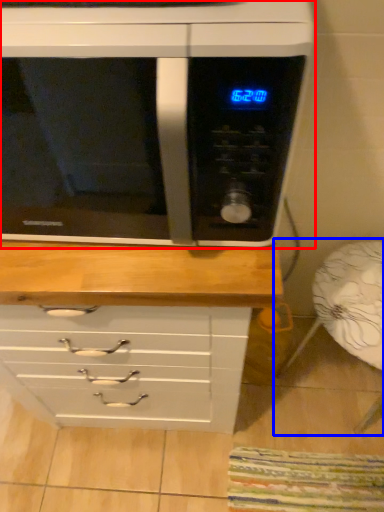
Question: Among these objects, which one is farthest to the camera, microwave oven (highlighted by a red box) or armchair (highlighted by a blue box)?

Choices:
 (A) microwave oven
 (B) armchair

Answer: (B)